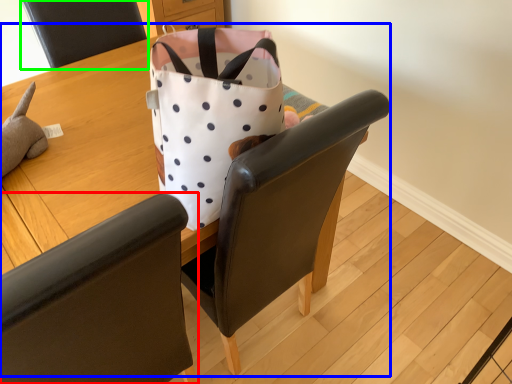
Question: Which is farther away from chair (highlighted by a red box)? table (highlighted by a blue box) or chair (highlighted by a green box)?

Choices:
 (A) table
 (B) chair

Answer: (B)